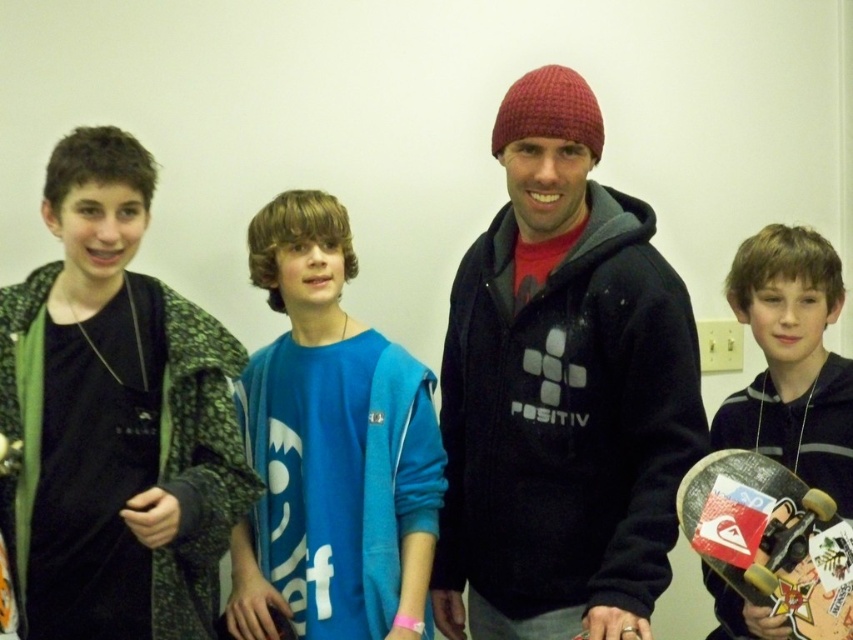
Question: From the image, what is the correct spatial relationship of green textured jacket at left in relation to blue cotton shirt at center?

Choices:
 (A) left
 (B) right

Answer: (A)

Question: Does blue cotton shirt at center appear on the left side of black matte skateboard at lower right?

Choices:
 (A) no
 (B) yes

Answer: (B)

Question: Considering the real-world distances, which object is closest to the dark gray hoodie at center?

Choices:
 (A) matte black skateboard at right
 (B) black matte skateboard at lower right
 (C) green textured jacket at left
 (D) blue cotton shirt at center

Answer: (B)

Question: Which of the following is the farthest from the observer?

Choices:
 (A) dark gray hoodie at center
 (B) matte black skateboard at right

Answer: (B)

Question: Can you confirm if blue cotton shirt at center is positioned to the left of black matte skateboard at lower right?

Choices:
 (A) no
 (B) yes

Answer: (B)

Question: Which point is farther to the camera?

Choices:
 (A) dark gray hoodie at center
 (B) black matte skateboard at lower right

Answer: (B)